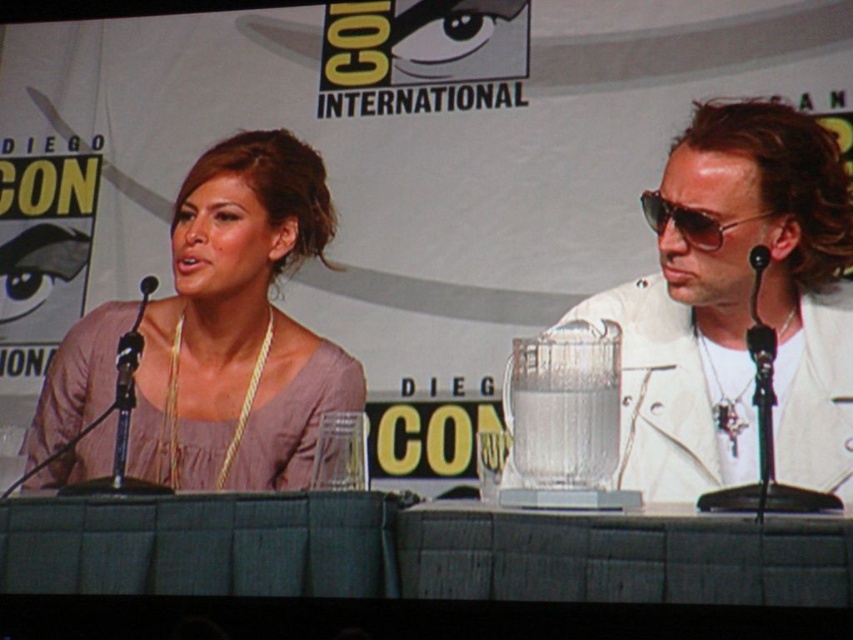
Is matte pink blouse at left taller than sunglasses at right?

Yes.

Is matte pink blouse at left in front of sunglasses at right?

No, matte pink blouse at left is further to the viewer.

Who is more distant from viewer, (247, 316) or (650, 224)?

The point (247, 316) is more distant.

Where is `matte pink blouse at left`? The image size is (853, 640). matte pink blouse at left is located at coordinates (239, 326).

Who is taller, white leather jacket at right or sunglasses at right?

white leather jacket at right is taller.

Consider the image. Which is above, white leather jacket at right or sunglasses at right?

Positioned higher is sunglasses at right.

Between point (778, 227) and point (653, 228), which one is positioned behind?

Point (653, 228)

The height and width of the screenshot is (640, 853). Identify the location of white leather jacket at right. (737, 307).

Is point (735, 160) positioned before point (218, 237)?

Yes, point (735, 160) is in front of point (218, 237).

The height and width of the screenshot is (640, 853). In order to click on white leather jacket at right in this screenshot , I will do `click(737, 307)`.